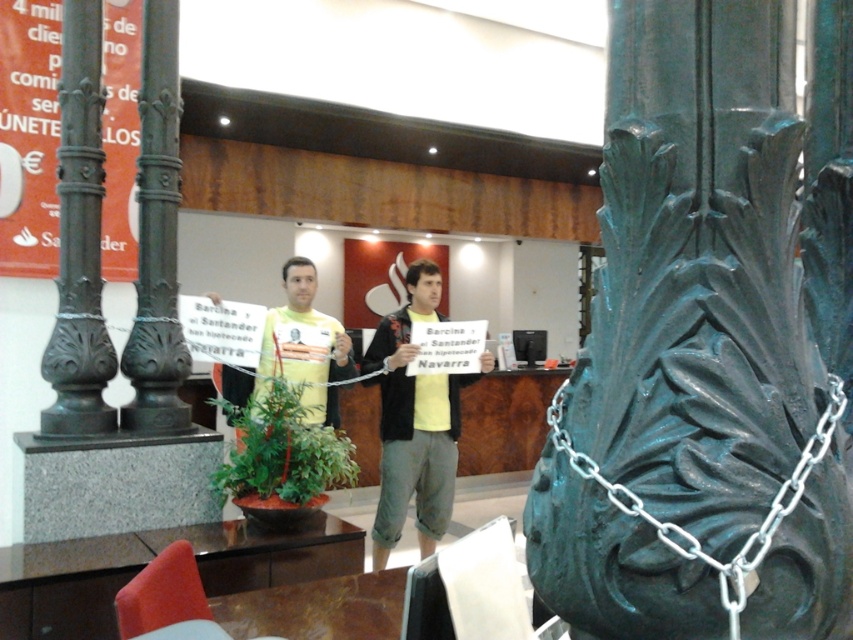
You are standing in the lobby and want to move from the dark green metal pillar at left to the yellow matte shirt at center. Which direction should you move to get closer?

Since the dark green metal pillar at left is closer to the viewer than the yellow matte shirt at center, you should move backward to get closer to the yellow matte shirt at center.

You are standing in the lobby and need to reach a point that is 1.10 meters away from the camera. Can you confirm if the point marked as point (738, 12) is exactly at that distance?

Yes, the point (738, 12) is exactly 1.10 meters away from the camera.